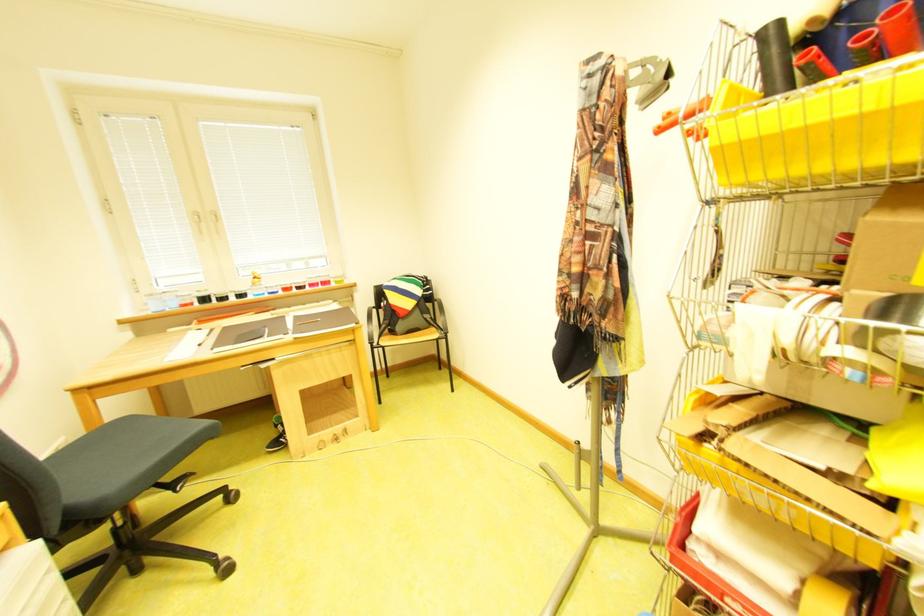
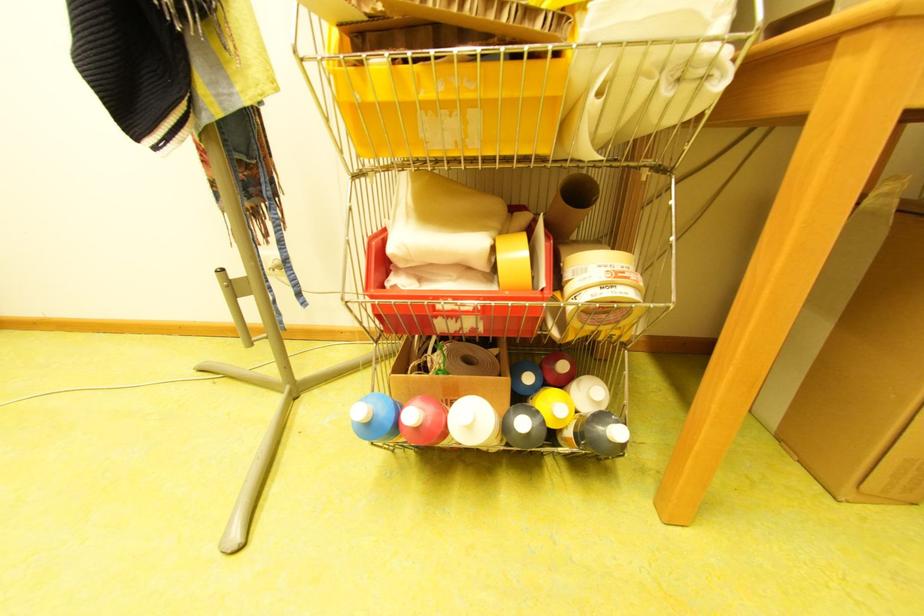
Question: The camera is either moving clockwise (left) or counter-clockwise (right) around the object. The first image is from the beginning of the video and the second image is from the end. Is the camera moving left or right when shooting the video?

Choices:
 (A) Left
 (B) Right

Answer: (A)